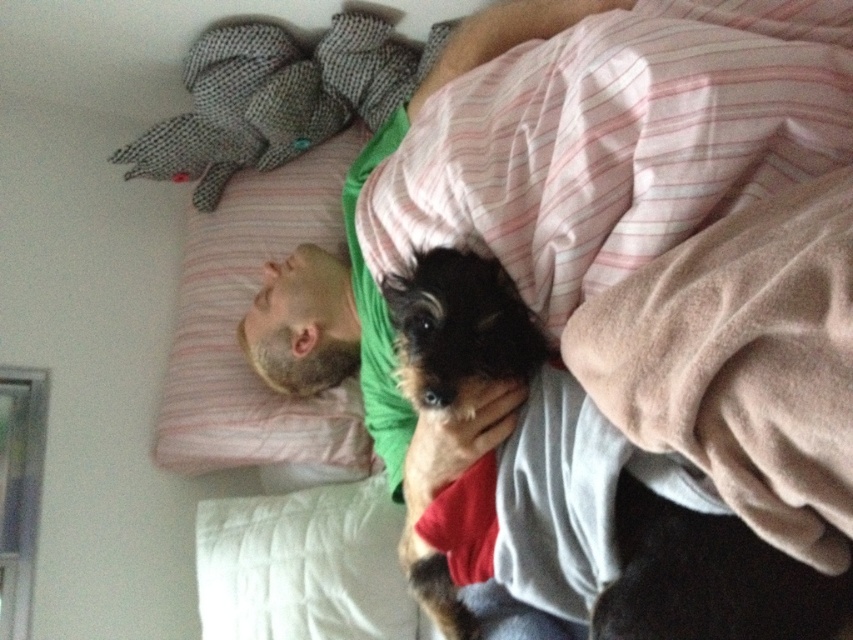
Question: Based on their relative distances, which object is nearer to the beige soft blanket at upper right?

Choices:
 (A) pink striped pillow at upper left
 (B) shaggy brown dog at center

Answer: (B)

Question: Is beige soft blanket at upper right to the right of pink striped pillow at upper left from the viewer's perspective?

Choices:
 (A) no
 (B) yes

Answer: (B)

Question: Which object is positioned closest to the shaggy brown dog at center?

Choices:
 (A) pink striped pillow at upper left
 (B) beige soft blanket at upper right

Answer: (B)

Question: Is beige soft blanket at upper right to the left of shaggy brown dog at center from the viewer's perspective?

Choices:
 (A) yes
 (B) no

Answer: (B)

Question: Among these objects, which one is nearest to the camera?

Choices:
 (A) pink striped pillow at upper left
 (B) beige soft blanket at upper right
 (C) shaggy brown dog at center

Answer: (B)

Question: Is beige soft blanket at upper right to the right of shaggy brown dog at center from the viewer's perspective?

Choices:
 (A) no
 (B) yes

Answer: (B)